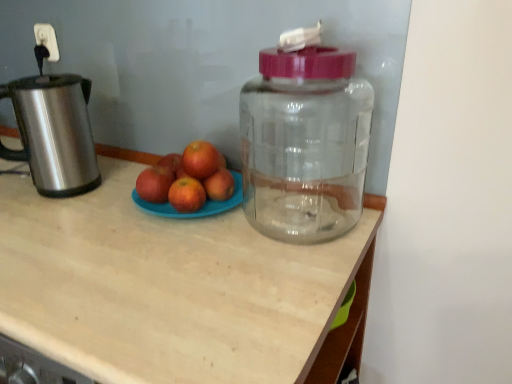
This screenshot has height=384, width=512. In order to click on free space in front of transparent plastic bottle at center in this screenshot , I will do `click(280, 278)`.